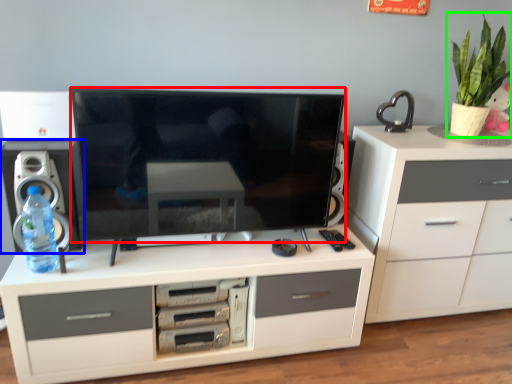
Question: Which object is positioned closest to television (highlighted by a red box)? Select from speaker (highlighted by a blue box) and houseplant (highlighted by a green box).

Choices:
 (A) speaker
 (B) houseplant

Answer: (A)